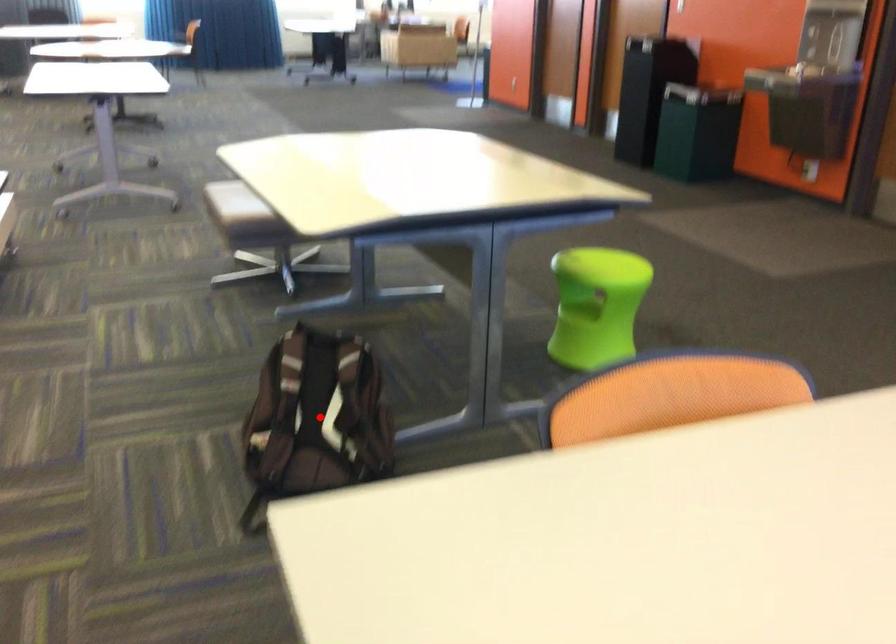
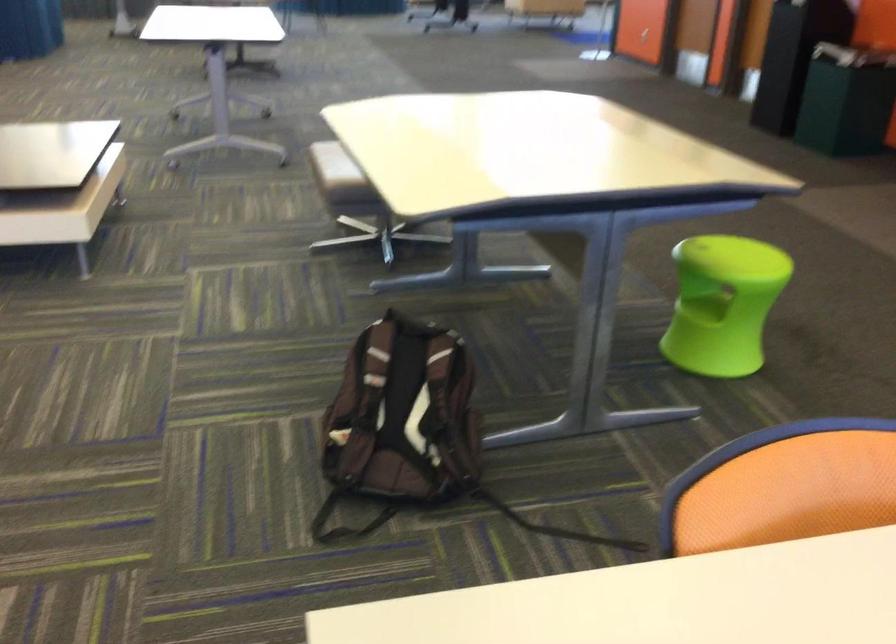
Find the pixel in the second image that matches the highlighted location in the first image.

(402, 413)